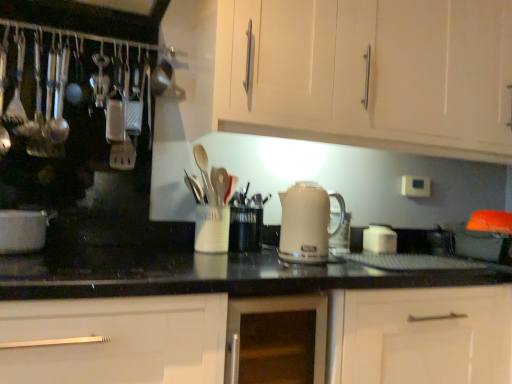
Question: Is white matte cabinet at upper center, arranged as the 1th cabinetry when viewed from the top, positioned with its back to white glossy cabinet at center, the 1th cabinetry positioned from the bottom?

Choices:
 (A) no
 (B) yes

Answer: (A)

Question: Is white matte cabinet at upper center, arranged as the 2th cabinetry when ordered from the bottom, positioned in front of white glossy cabinet at center, which appears as the second cabinetry when viewed from the top?

Choices:
 (A) yes
 (B) no

Answer: (B)

Question: Is white matte cabinet at upper center, arranged as the 1th cabinetry when viewed from the top, far away from white glossy cabinet at center, the 1th cabinetry positioned from the bottom?

Choices:
 (A) yes
 (B) no

Answer: (B)

Question: Is white matte cabinet at upper center, arranged as the 1th cabinetry when viewed from the top, outside of white glossy cabinet at center, which appears as the second cabinetry when viewed from the top?

Choices:
 (A) no
 (B) yes

Answer: (B)

Question: From a real-world perspective, is white matte cabinet at upper center, arranged as the 1th cabinetry when viewed from the top, on white glossy cabinet at center, which appears as the second cabinetry when viewed from the top?

Choices:
 (A) yes
 (B) no

Answer: (A)

Question: Based on their positions, is white glossy cabinet at center, the 1th cabinetry positioned from the bottom, located to the left or right of white glossy pot at left?

Choices:
 (A) right
 (B) left

Answer: (A)

Question: From the image's perspective, relative to white glossy pot at left, is white glossy cabinet at center, which appears as the second cabinetry when viewed from the top, above or below?

Choices:
 (A) below
 (B) above

Answer: (A)

Question: Is white glossy cabinet at center, the 1th cabinetry positioned from the bottom, in front of or behind white glossy pot at left in the image?

Choices:
 (A) behind
 (B) front

Answer: (B)

Question: Is white glossy cabinet at center, which appears as the second cabinetry when viewed from the top, inside or outside of white glossy pot at left?

Choices:
 (A) inside
 (B) outside

Answer: (B)

Question: From their relative heights in the image, would you say black glass gas stove at lower left is taller or shorter than white matte cabinet at upper center, arranged as the 2th cabinetry when ordered from the bottom?

Choices:
 (A) tall
 (B) short

Answer: (B)

Question: Would you say black glass gas stove at lower left is to the left or to the right of white matte cabinet at upper center, arranged as the 2th cabinetry when ordered from the bottom, in the picture?

Choices:
 (A) left
 (B) right

Answer: (A)

Question: In the image, is black glass gas stove at lower left positioned in front of or behind white matte cabinet at upper center, arranged as the 2th cabinetry when ordered from the bottom?

Choices:
 (A) front
 (B) behind

Answer: (A)

Question: Is point (139, 258) closer or farther from the camera than point (281, 59)?

Choices:
 (A) farther
 (B) closer

Answer: (A)

Question: Is white plastic electric outlet at upper right wider or thinner than white glossy pot at left?

Choices:
 (A) thin
 (B) wide

Answer: (A)

Question: Choose the correct answer: Is white plastic electric outlet at upper right inside white glossy pot at left or outside it?

Choices:
 (A) outside
 (B) inside

Answer: (A)